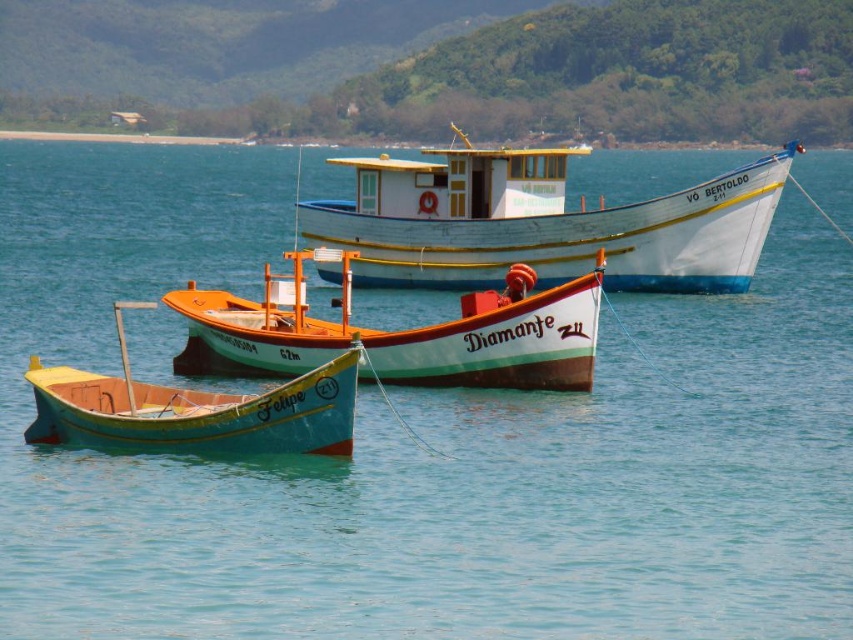
Question: Which point appears farthest from the camera in this image?

Choices:
 (A) (178, 448)
 (B) (485, 332)
 (C) (483, 288)

Answer: (C)

Question: Which object is positioned farthest from the orange wooden boat at center?

Choices:
 (A) white wooden boat at center
 (B) teal matte boat at center

Answer: (A)

Question: From the image, what is the correct spatial relationship of white wooden boat at center in relation to orange wooden boat at center?

Choices:
 (A) right
 (B) left

Answer: (A)

Question: Which object is the farthest from the orange wooden boat at center?

Choices:
 (A) white wooden boat at center
 (B) teal matte boat at center

Answer: (A)

Question: Is white wooden boat at center smaller than teal matte boat at center?

Choices:
 (A) no
 (B) yes

Answer: (A)

Question: Can you confirm if orange wooden boat at center is bigger than teal matte boat at center?

Choices:
 (A) no
 (B) yes

Answer: (B)